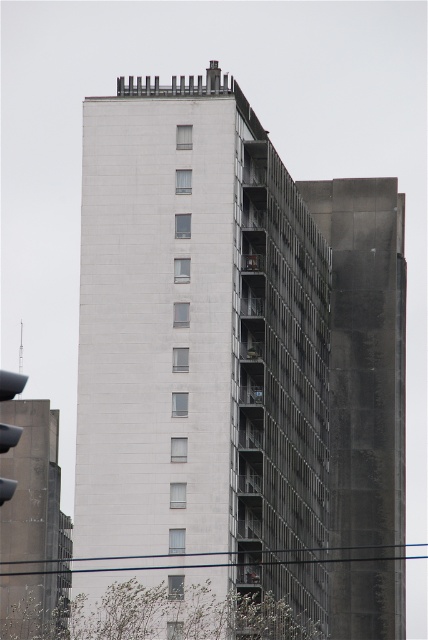
Question: Does white concrete building at center have a lesser width compared to matte black traffic light at left?

Choices:
 (A) no
 (B) yes

Answer: (B)

Question: Which point is closer to the camera?

Choices:
 (A) matte black traffic light at left
 (B) white concrete building at center

Answer: (A)

Question: Is white concrete building at center to the right of matte black traffic light at left from the viewer's perspective?

Choices:
 (A) no
 (B) yes

Answer: (B)

Question: Is white concrete building at center positioned behind matte black traffic light at left?

Choices:
 (A) yes
 (B) no

Answer: (A)